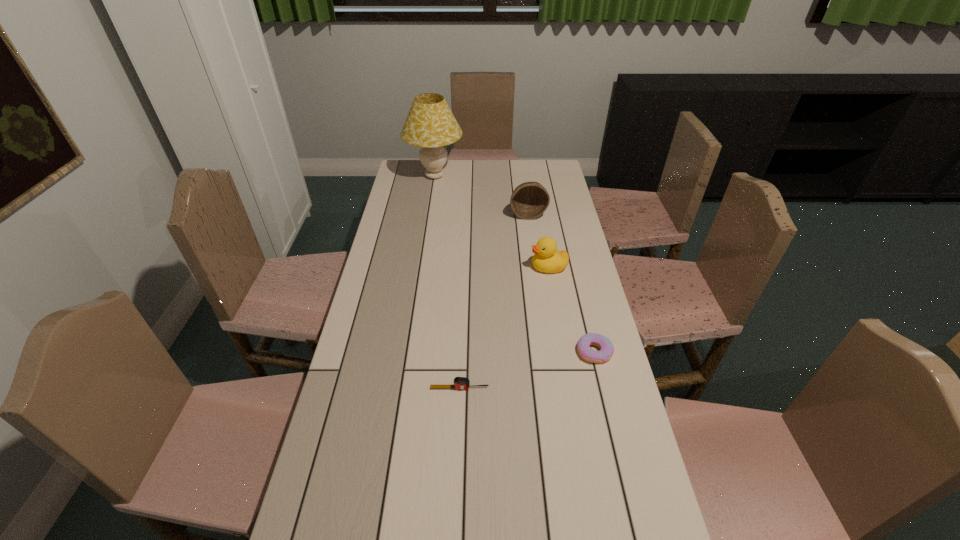
Locate an element on the screen. This screenshot has height=540, width=960. object that is at the far left corner is located at coordinates (430, 124).

In the image, there is a desktop. Where is `vacant space at the far edge`? vacant space at the far edge is located at coordinates (526, 179).

Locate an element on the screen. vacant space at the left edge is located at coordinates (398, 297).

Identify the location of vacant space at the right edge of the desktop. (551, 215).

Locate an element on the screen. vacant area between the tallest object and the nearest object is located at coordinates (447, 282).

The width and height of the screenshot is (960, 540). What are the coordinates of `free space that is in between the third shortest object and the farthest object` in the screenshot? It's located at (492, 221).

Where is `free space between the third nearest object and the tape measure`? free space between the third nearest object and the tape measure is located at coordinates tap(504, 328).

You are a GUI agent. You are given a task and a screenshot of the screen. Output one action in this format:
    pyautogui.click(x=<x>, y=<y>)
    Task: Click on the vacant area that lies between the second farthest object and the duck
    
    Given the screenshot: What is the action you would take?
    pyautogui.click(x=539, y=241)

The width and height of the screenshot is (960, 540). Identify the location of vacant space in between the nearest object and the second tallest object. (493, 301).

The height and width of the screenshot is (540, 960). In order to click on vacant point located between the doughnut and the duck in this screenshot , I will do `click(571, 309)`.